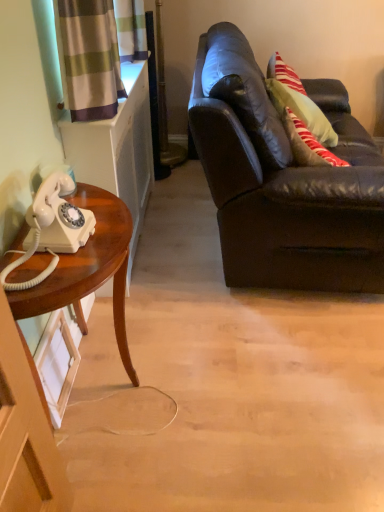
The width and height of the screenshot is (384, 512). Find the location of `wooden desk at left`. wooden desk at left is located at coordinates (88, 270).

What do you see at coordinates (51, 228) in the screenshot?
I see `white glossy corded phone at left` at bounding box center [51, 228].

At what (x,y) coordinates should I click in order to perform the action: click on white glossy corded phone at left. Please return your answer as a coordinate pair (x, y). This screenshot has width=384, height=512. Looking at the image, I should click on (51, 228).

In order to click on matte black leather couch at right in this screenshot , I will do `click(289, 192)`.

Is white glossy corded phone at left in contact with matte black leather couch at right?

No.

Is white glossy corded phone at left outside of matte black leather couch at right?

Yes, white glossy corded phone at left is located beyond the bounds of matte black leather couch at right.

Measure the distance from white glossy corded phone at left to matte black leather couch at right.

They are 36.96 inches apart.

Which point is more distant from viewer, (43, 195) or (201, 105)?

The point (201, 105) is farther from the camera.

Can we say wooden desk at left lies outside white glossy corded phone at left?

Yes, wooden desk at left is located beyond the bounds of white glossy corded phone at left.

From a real-world perspective, is wooden desk at left physically located above or below white glossy corded phone at left?

From a real-world perspective, wooden desk at left is physically below white glossy corded phone at left.

Could you tell me if wooden desk at left is turned towards white glossy corded phone at left?

No, wooden desk at left does not turn towards white glossy corded phone at left.

Is the position of wooden desk at left less distant than that of white glossy corded phone at left?

No, wooden desk at left is further to the viewer.

Considering the sizes of objects matte black leather couch at right and wooden desk at left in the image provided, who is wider, matte black leather couch at right or wooden desk at left?

matte black leather couch at right.

In the scene shown: Who is bigger, matte black leather couch at right or wooden desk at left?

matte black leather couch at right.

From their relative heights in the image, would you say matte black leather couch at right is taller or shorter than wooden desk at left?

Considering their sizes, matte black leather couch at right has more height than wooden desk at left.

Is matte black leather couch at right completely or partially outside of wooden desk at left?

Indeed, matte black leather couch at right is completely outside wooden desk at left.

From the image's perspective, which object appears higher, white glossy corded phone at left or wooden desk at left?

white glossy corded phone at left appears higher in the image.

Does white glossy corded phone at left have a smaller size compared to wooden desk at left?

Correct, white glossy corded phone at left occupies less space than wooden desk at left.

Between point (55, 207) and point (61, 293), which one is positioned in front?

The point (61, 293) is closer.

Does white glossy corded phone at left have a greater width compared to wooden desk at left?

No.

How much distance is there between matte black leather couch at right and white glossy corded phone at left?

They are 36.96 inches apart.

Considering the positions of objects matte black leather couch at right and white glossy corded phone at left in the image provided, who is behind, matte black leather couch at right or white glossy corded phone at left?

matte black leather couch at right.

In the image, there is a matte black leather couch at right. In order to click on corded phone below it (from the image's perspective) in this screenshot , I will do `click(51, 228)`.

Is matte black leather couch at right not near white glossy corded phone at left?

No.

Is the depth of wooden desk at left less than that of matte black leather couch at right?

Yes, it is in front of matte black leather couch at right.

Which of these two, wooden desk at left or matte black leather couch at right, is thinner?

Thinner between the two is wooden desk at left.

The image size is (384, 512). Identify the location of studio couch located underneath the white glossy corded phone at left (from a real-world perspective). (289, 192).

At what (x,y) coordinates should I click in order to perform the action: click on corded phone located on the left of wooden desk at left. Please return your answer as a coordinate pair (x, y). Looking at the image, I should click on pos(51,228).

Estimate the real-world distances between objects in this image. Which object is further from white glossy corded phone at left, matte black leather couch at right or wooden desk at left?

matte black leather couch at right is further to white glossy corded phone at left.

Which object lies further to the anchor point wooden desk at left, white glossy corded phone at left or matte black leather couch at right?

matte black leather couch at right is positioned further to the anchor wooden desk at left.

Looking at the image, which one is located closer to matte black leather couch at right, white glossy corded phone at left or wooden desk at left?

wooden desk at left is positioned closer to the anchor matte black leather couch at right.

Estimate the real-world distances between objects in this image. Which object is further from wooden desk at left, matte black leather couch at right or white glossy corded phone at left?

The object further to wooden desk at left is matte black leather couch at right.

Based on their spatial positions, is wooden desk at left or white glossy corded phone at left closer to matte black leather couch at right?

wooden desk at left lies closer to matte black leather couch at right than the other object.

Estimate the real-world distances between objects in this image. Which object is closer to white glossy corded phone at left, wooden desk at left or matte black leather couch at right?

Among the two, wooden desk at left is located nearer to white glossy corded phone at left.

This screenshot has height=512, width=384. What are the coordinates of `desk situated between white glossy corded phone at left and matte black leather couch at right from left to right` in the screenshot? It's located at (88, 270).